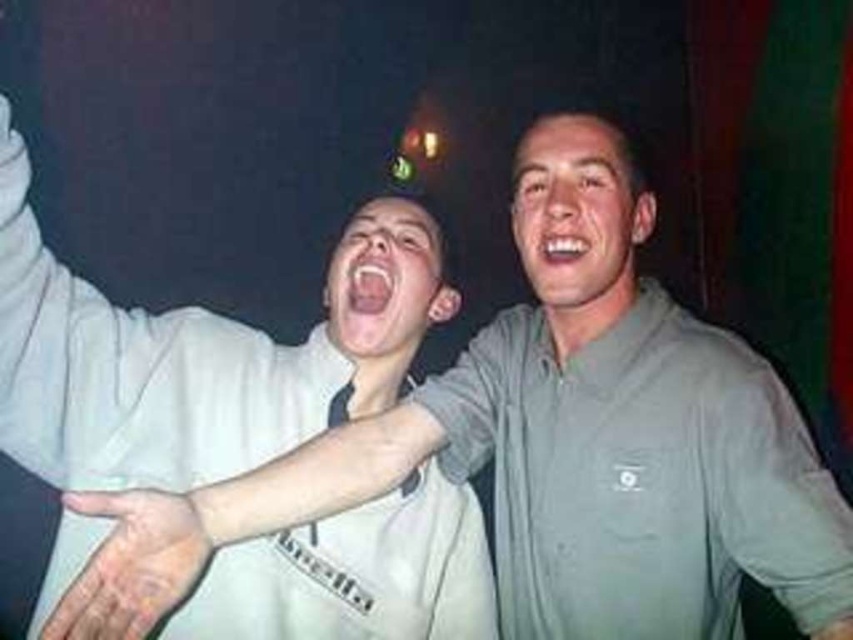
Question: Considering the real-world distances, which object is farthest from the green matte hand at upper center?

Choices:
 (A) white glossy teeth at center
 (B) pink glossy teeth at center
 (C) gray cotton arm at right
 (D) dry skin at center

Answer: (B)

Question: Is dry skin at center behind pink glossy teeth at center?

Choices:
 (A) no
 (B) yes

Answer: (A)

Question: Considering the relative positions of dry skin at center and pink glossy teeth at center in the image provided, where is dry skin at center located with respect to pink glossy teeth at center?

Choices:
 (A) right
 (B) left

Answer: (B)

Question: Is the position of dry skin at center less distant than that of pink glossy teeth at center?

Choices:
 (A) no
 (B) yes

Answer: (B)

Question: Among these points, which one is nearest to the camera?

Choices:
 (A) (548, 240)
 (B) (67, 413)
 (C) (824, 627)

Answer: (C)

Question: Among these points, which one is farthest from the camera?

Choices:
 (A) (544, 244)
 (B) (822, 636)
 (C) (70, 493)
 (D) (352, 268)

Answer: (D)